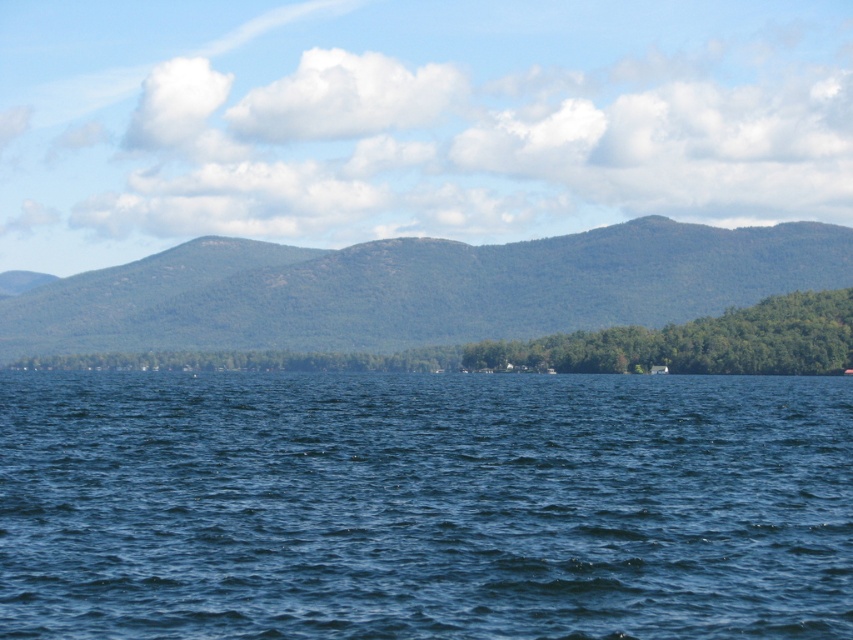
Describe the element at coordinates (424, 506) in the screenshot. This screenshot has width=853, height=640. I see `blue liquid water at center` at that location.

Is blue liquid water at center above green forested mountain at center?

Incorrect, blue liquid water at center is not positioned above green forested mountain at center.

Is point (811, 529) positioned before point (654, 266)?

Yes, it is in front of point (654, 266).

Locate an element on the screen. blue liquid water at center is located at coordinates (424, 506).